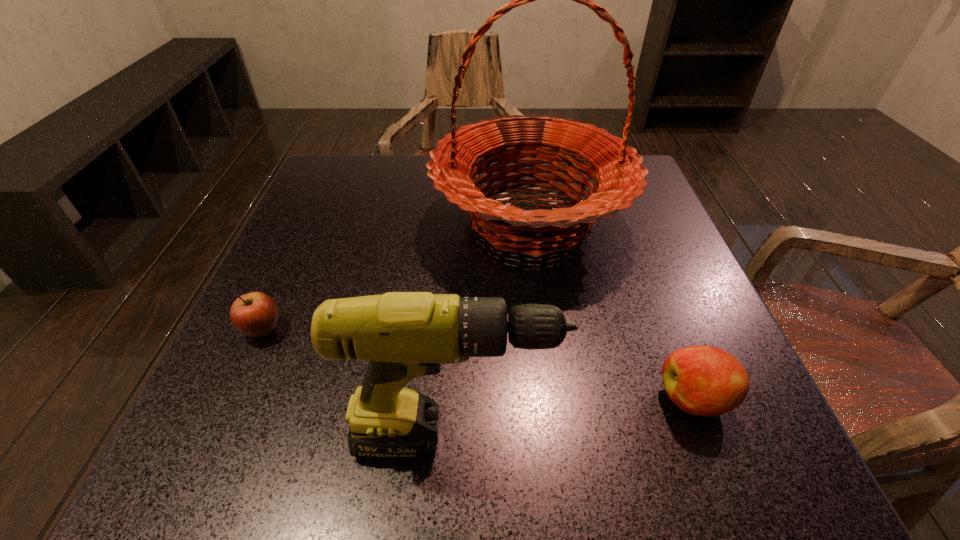
The width and height of the screenshot is (960, 540). I want to click on object positioned at the far edge, so click(x=616, y=169).

Image resolution: width=960 pixels, height=540 pixels. What are the coordinates of `drill located at the near edge` in the screenshot? It's located at (403, 335).

What are the coordinates of `apple that is at the near edge` in the screenshot? It's located at (706, 381).

Find the location of a particular element. object at the left edge is located at coordinates (255, 314).

Identify the location of basket situated at the right edge. (616, 169).

The image size is (960, 540). Identify the location of apple present at the right edge. (706, 381).

Locate an element on the screen. object at the far right corner is located at coordinates (616, 169).

Identify the location of object positioned at the near right corner. (706, 381).

At what (x,y) coordinates should I click in order to perform the action: click on blank space at the far edge of the desktop. Please return your answer as a coordinate pair (x, y). The height and width of the screenshot is (540, 960). Looking at the image, I should click on (443, 204).

The image size is (960, 540). I want to click on vacant space at the near edge of the desktop, so click(542, 421).